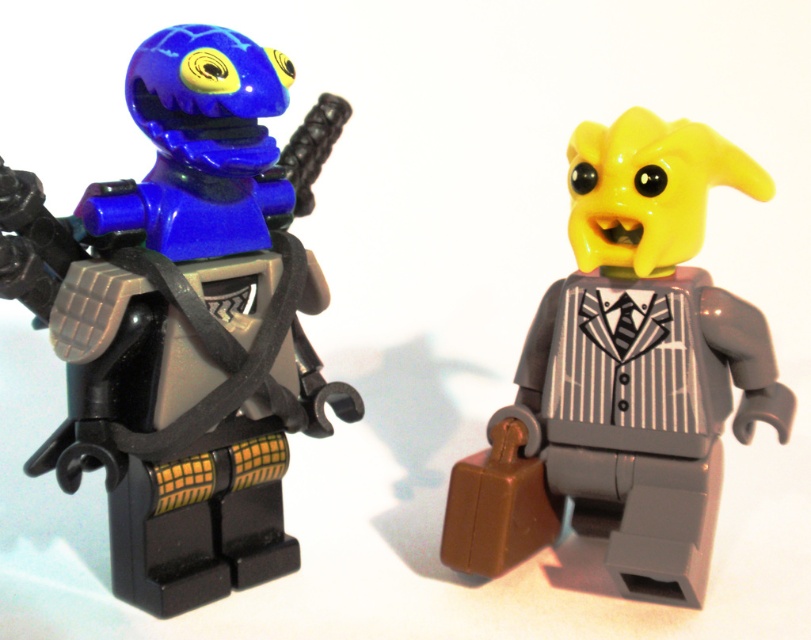
Question: Is shiny blue helmet at left behind yellow matte suit at center?

Choices:
 (A) yes
 (B) no

Answer: (B)

Question: In this image, where is shiny blue helmet at left located relative to yellow matte suit at center?

Choices:
 (A) right
 (B) left

Answer: (B)

Question: Which of the following is the farthest from the observer?

Choices:
 (A) (722, 397)
 (B) (71, 417)

Answer: (A)

Question: Which of the following is the closest to the observer?

Choices:
 (A) yellow matte suit at center
 (B) shiny blue helmet at left

Answer: (B)

Question: Which of the following is the farthest from the observer?

Choices:
 (A) yellow matte suit at center
 (B) shiny blue helmet at left

Answer: (A)

Question: Does shiny blue helmet at left appear on the right side of yellow matte suit at center?

Choices:
 (A) yes
 (B) no

Answer: (B)